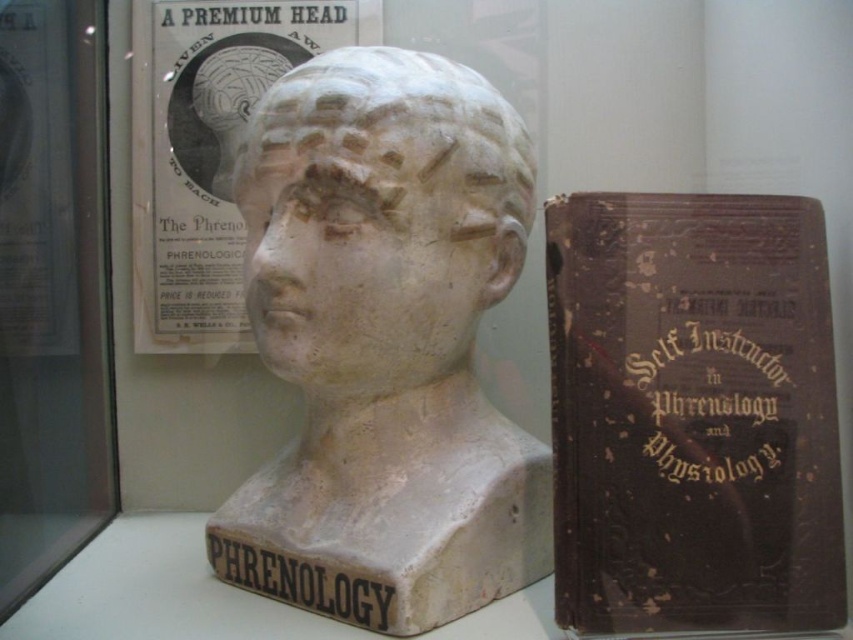
Based on the photo, you are a museum visitor standing in front of the display case. You see the brown leather book at right and the white plaster head at center. Which object is positioned farther to the right within the display case?

The brown leather book at right is positioned farther to the right than the white plaster head at center because the brown leather book at right is to the right of white plaster head at center.

You are a museum curator arranging items in a display case. You have a brown leather book at right and a white plaster head at center. Which item has a smaller width?

The brown leather book at right has a lesser width compared to the white plaster head at center, so the brown leather book at right is smaller in width.

You are a museum visitor who wants to know which item is taller between the brown leather book at right and the white plaster head at center. According to the display, which one is taller?

The brown leather book at right is taller than the white plaster head at center.